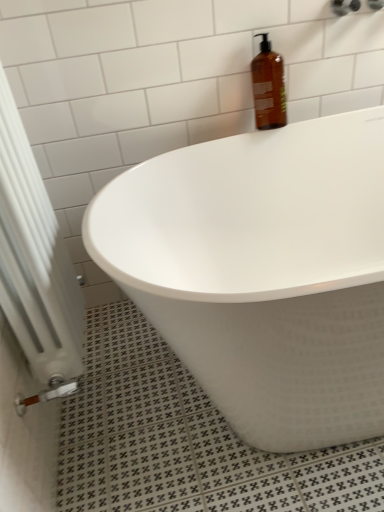
Question: Is brown glass bottle at upper center wider or thinner than white metallic radiator at lower left?

Choices:
 (A) thin
 (B) wide

Answer: (A)

Question: In terms of height, does brown glass bottle at upper center look taller or shorter compared to white metallic radiator at lower left?

Choices:
 (A) tall
 (B) short

Answer: (B)

Question: Estimate the real-world distances between objects in this image. Which object is farther from the white glossy bathtub at upper center?

Choices:
 (A) white metallic radiator at lower left
 (B) brown glass bottle at upper center

Answer: (B)

Question: Which of these objects is positioned closest to the white metallic radiator at lower left?

Choices:
 (A) white glossy bathtub at upper center
 (B) brown glass bottle at upper center

Answer: (A)